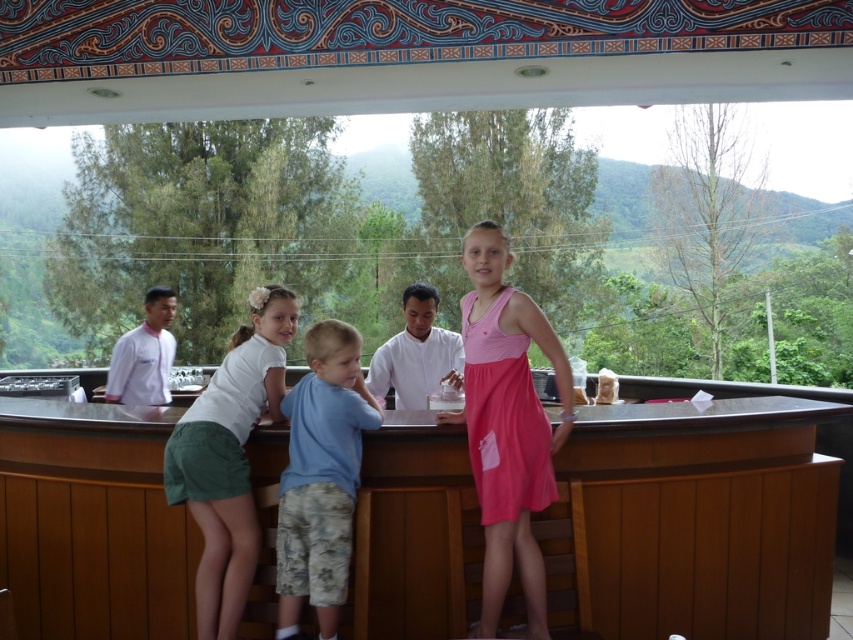
Looking at this image, between white cotton shirt at center and clear plastic cup at center, which one is positioned lower?

white cotton shirt at center is lower down.

Measure the distance between white cotton shirt at center and camera.

white cotton shirt at center is 2.70 meters from camera.

I want to click on white cotton shirt at center, so [x=229, y=458].

Can you confirm if pink satin dress at center is thinner than clear plastic cup at center?

Incorrect, pink satin dress at center's width is not less than clear plastic cup at center's.

Is point (489, 556) farther from viewer compared to point (462, 396)?

No, (489, 556) is in front of (462, 396).

You are a GUI agent. You are given a task and a screenshot of the screen. Output one action in this format:
    pyautogui.click(x=<x>, y=<y>)
    Task: Click on the pink satin dress at center
    
    Given the screenshot: What is the action you would take?
    pyautogui.click(x=508, y=422)

Is pink satin dress at center positioned behind white cotton shirt at center?

No, it is not.

Is pink satin dress at center wider than white cotton shirt at center?

Yes, pink satin dress at center is wider than white cotton shirt at center.

Who is more forward, (529, 483) or (229, 560)?

Positioned in front is point (529, 483).

I want to click on pink satin dress at center, so click(x=508, y=422).